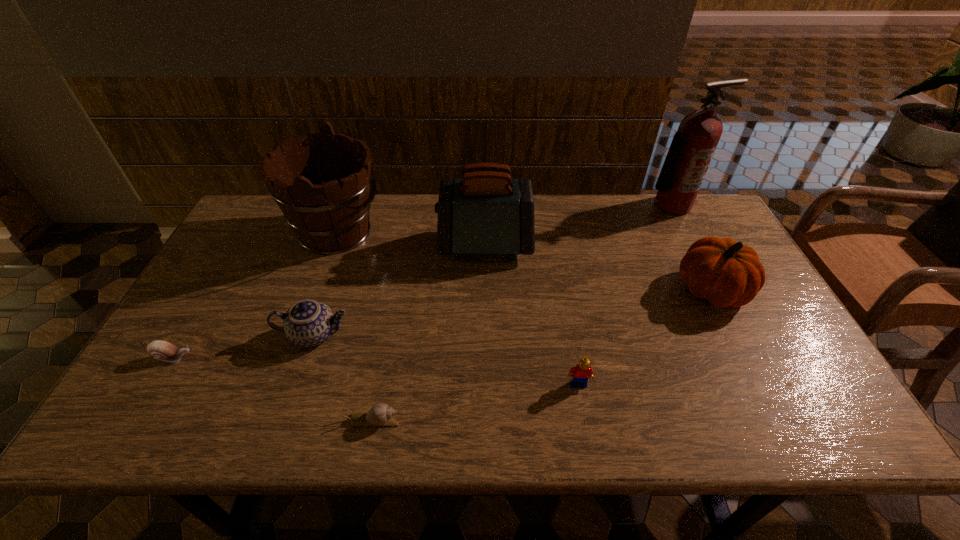
I want to click on free space that satisfies the following two spatial constraints: 1. on the front-facing side of the Lego; 2. on the shell of the nearest object, so click(585, 420).

Where is `vacant area that satisfies the following two spatial constraints: 1. on the front of the fire extinguisher near the operation label; 2. on the shell of the right escargot`? vacant area that satisfies the following two spatial constraints: 1. on the front of the fire extinguisher near the operation label; 2. on the shell of the right escargot is located at coordinates (784, 420).